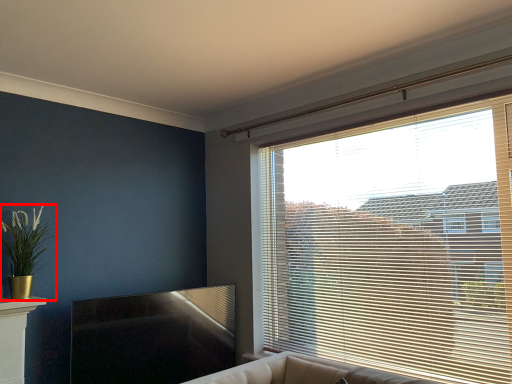
Question: In this image, where is houseplant (annotated by the red box) located relative to window blind?

Choices:
 (A) right
 (B) left

Answer: (B)